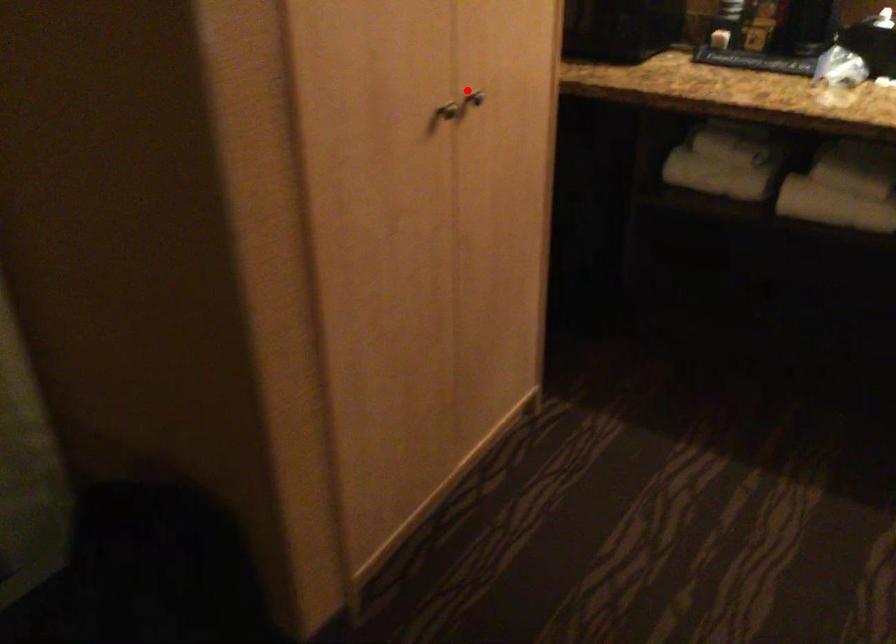
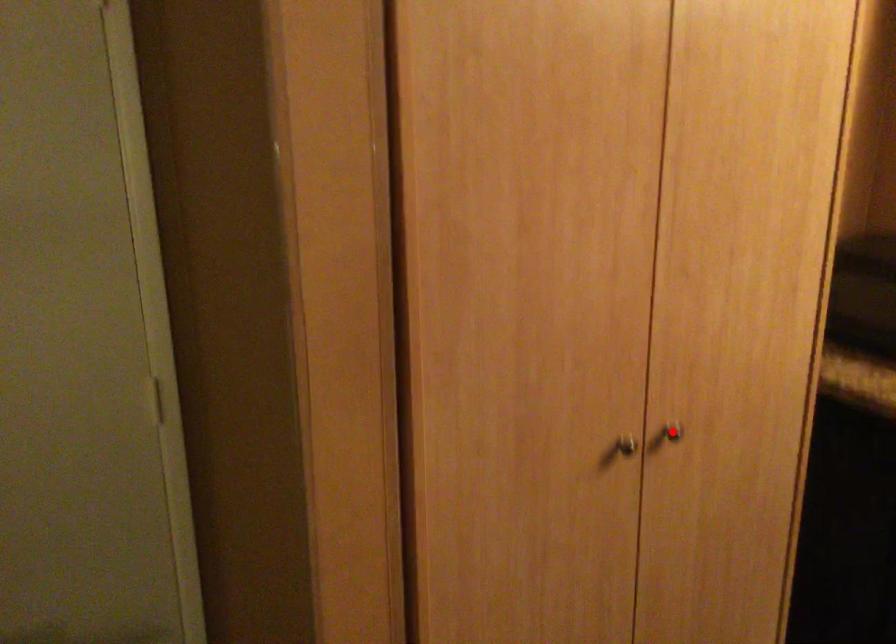
I am providing you with two images of the same scene from different viewpoints. A red point is marked on the first image and another point is marked on the second image. Are the points marked in image1 and image2 representing the same 3D position?

Yes